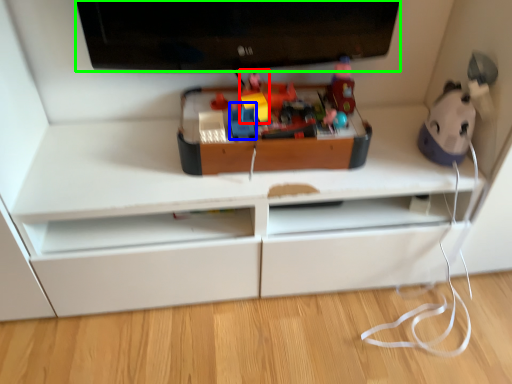
Question: Considering the real-world distances, which object is closest to toy (highlighted by a red box)? toy (highlighted by a blue box) or television (highlighted by a green box).

Choices:
 (A) toy
 (B) television

Answer: (A)